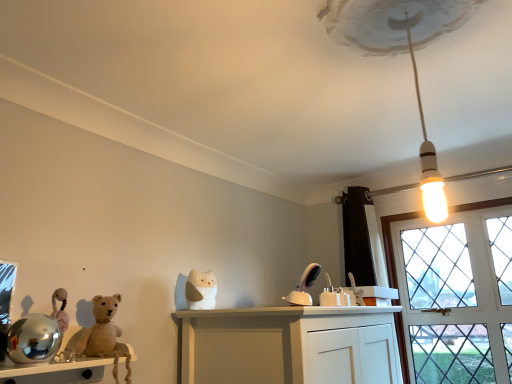
Question: Should I look upward or downward to see fuzzy beige teddy bear at left?

Choices:
 (A) up
 (B) down

Answer: (B)

Question: Does fuzzy beige teddy bear at left come in front of white matte cat at center?

Choices:
 (A) no
 (B) yes

Answer: (B)

Question: From a real-world perspective, is fuzzy beige teddy bear at left beneath white matte cat at center?

Choices:
 (A) yes
 (B) no

Answer: (A)

Question: Does fuzzy beige teddy bear at left have a greater height compared to white matte cat at center?

Choices:
 (A) no
 (B) yes

Answer: (B)

Question: Is fuzzy beige teddy bear at left oriented away from white matte cat at center?

Choices:
 (A) yes
 (B) no

Answer: (B)

Question: Can you confirm if fuzzy beige teddy bear at left is thinner than white matte cat at center?

Choices:
 (A) no
 (B) yes

Answer: (A)

Question: From a real-world perspective, is fuzzy beige teddy bear at left on white matte cat at center?

Choices:
 (A) yes
 (B) no

Answer: (B)

Question: Does white matte cat at center have a lesser height compared to wooden shelf at lower left?

Choices:
 (A) no
 (B) yes

Answer: (A)

Question: Can you confirm if white matte cat at center is wider than wooden shelf at lower left?

Choices:
 (A) yes
 (B) no

Answer: (B)

Question: Could wooden shelf at lower left be considered to be inside white matte cat at center?

Choices:
 (A) yes
 (B) no

Answer: (B)

Question: Are white matte cat at center and wooden shelf at lower left located far from each other?

Choices:
 (A) no
 (B) yes

Answer: (A)

Question: Is white matte cat at center bigger than wooden shelf at lower left?

Choices:
 (A) yes
 (B) no

Answer: (B)

Question: Does white matte cat at center have a smaller size compared to wooden shelf at lower left?

Choices:
 (A) no
 (B) yes

Answer: (B)

Question: Can you confirm if fuzzy beige teddy bear at left is wider than white glossy bulb at upper center?

Choices:
 (A) yes
 (B) no

Answer: (B)